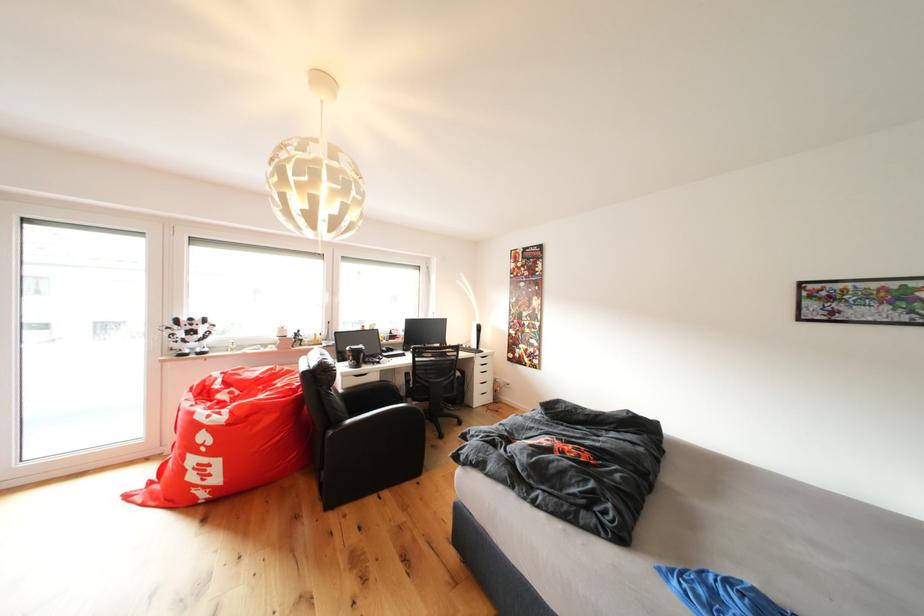
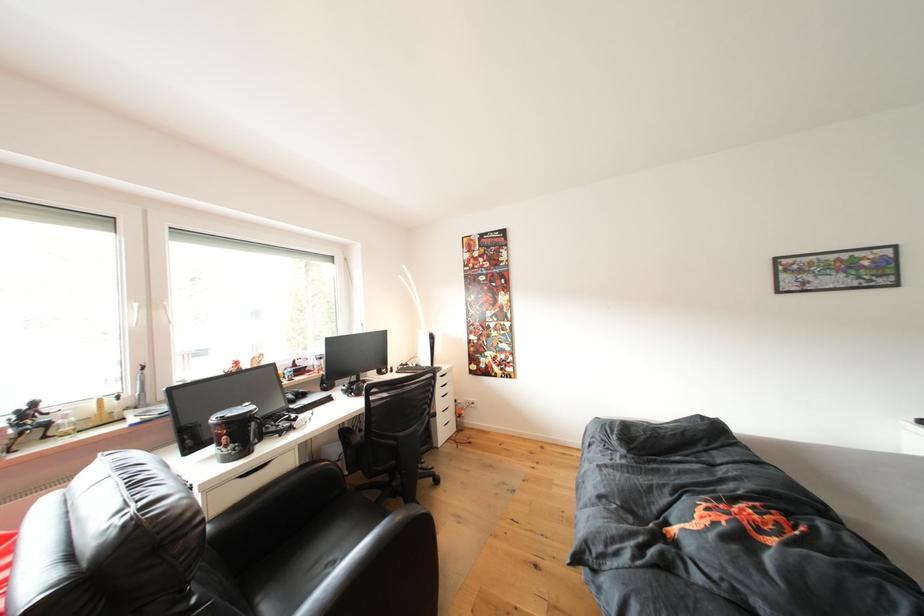
The point at (368, 363) is marked in the first image. Where is the corresponding point in the second image?

(253, 440)